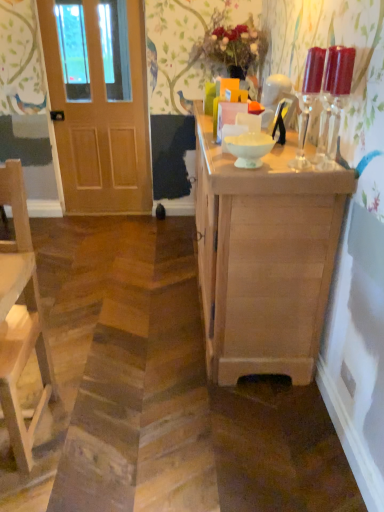
The height and width of the screenshot is (512, 384). I want to click on vacant area that is situated to the right of white glossy bowl at center, so click(x=282, y=165).